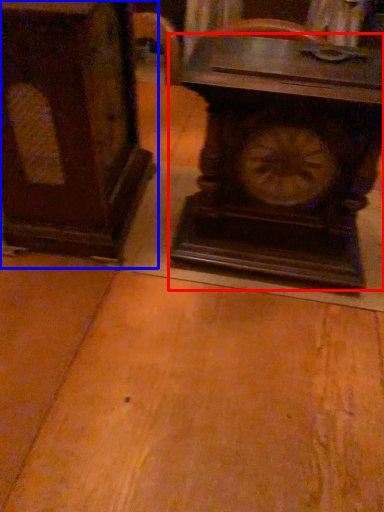
Question: Which point is closer to the camera, wall clock (highlighted by a red box) or furniture (highlighted by a blue box)?

Choices:
 (A) wall clock
 (B) furniture

Answer: (B)